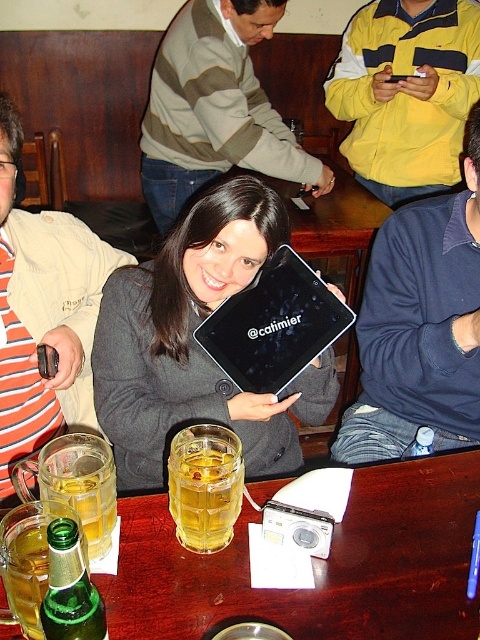
You are a bartender preparing to place both the matte black tablet at center and the green glass bottle at lower left on a narrow shelf that can only accommodate one item at a time. Which item should you choose to fit on the shelf first based on their widths?

The green glass bottle at lower left should be placed first since it has a smaller width compared to the matte black tablet at center, which is wider and may not fit on the narrow shelf.

You are a bartender at the pub and need to place a new drink order form on the table where the matte black tablet at center and the green glass bottle at lower left are located. Where should you place the form so it doesn

The matte black tablet at center is to the right of the green glass bottle at lower left, so you should place the form to the left of the green glass bottle at lower left to avoid blocking the tablet.